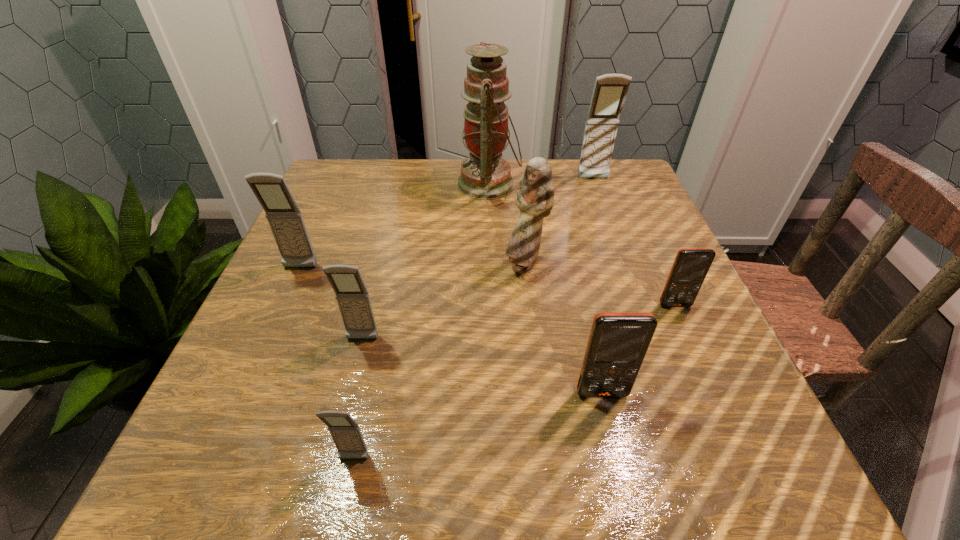
Identify the location of free space located 0.100m on the screen of the bigger orange cellular telephone. This screenshot has width=960, height=540. (618, 464).

This screenshot has width=960, height=540. I want to click on vacant space situated 0.130m on the screen of the fourth nearest cellular telephone, so click(702, 367).

This screenshot has width=960, height=540. I want to click on oil lamp at the far edge, so click(484, 175).

Where is `cellular telephone that is at the far edge`? This screenshot has width=960, height=540. cellular telephone that is at the far edge is located at coordinates (610, 90).

Locate an element on the screen. The height and width of the screenshot is (540, 960). object at the near edge is located at coordinates (347, 436).

Locate an element on the screen. object that is at the left edge is located at coordinates (285, 219).

I want to click on object that is at the far right corner, so click(x=610, y=90).

The image size is (960, 540). Identify the location of free space at the far edge of the desktop. (429, 165).

Where is `vacant space at the left edge`? Image resolution: width=960 pixels, height=540 pixels. vacant space at the left edge is located at coordinates (329, 212).

Find the location of a particular element. The width and height of the screenshot is (960, 540). vacant space at the right edge is located at coordinates (660, 363).